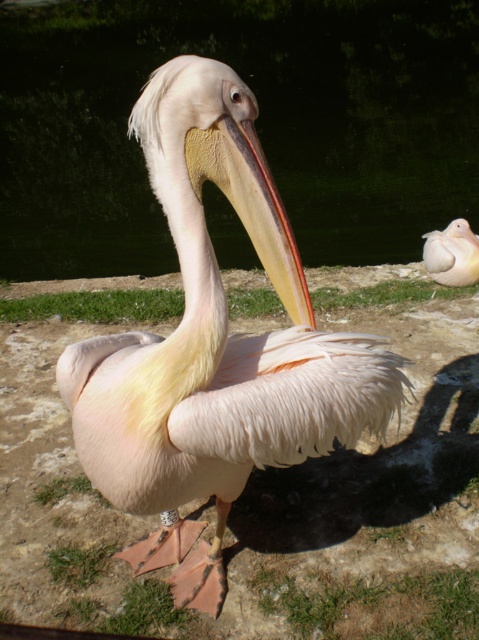
You are a photographer aiming to capture the pelican and its surroundings. Given that the transparent water at center and the yellowish matte beak at center are both in your frame, which object occupies a wider area in the image?

The transparent water at center has a greater width than the yellowish matte beak at center, so the transparent water at center occupies a wider area in the image.

You are a birdwatcher observing the pelican in the scene. You notice the transparent water at center and the yellowish matte beak at center. Which object occupies a bigger area in the image?

The transparent water at center has a larger size compared to the yellowish matte beak at center, so the transparent water at center occupies a bigger area in the image.